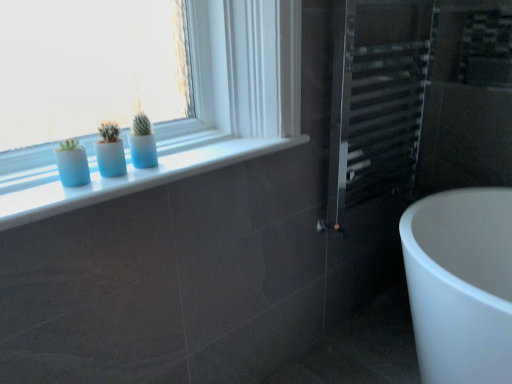
Question: From their relative heights in the image, would you say metallic silver radiator at right is taller or shorter than white glossy window sill at upper center?

Choices:
 (A) short
 (B) tall

Answer: (B)

Question: Relative to white glossy window sill at upper center, is metallic silver radiator at right in front or behind?

Choices:
 (A) behind
 (B) front

Answer: (A)

Question: Which of these objects is positioned closest to the white glossy window sill at upper center?

Choices:
 (A) metallic silver radiator at right
 (B) matte blue vase at left

Answer: (B)

Question: Which object is positioned closest to the matte blue vase at left?

Choices:
 (A) metallic silver radiator at right
 (B) white glossy window sill at upper center

Answer: (B)